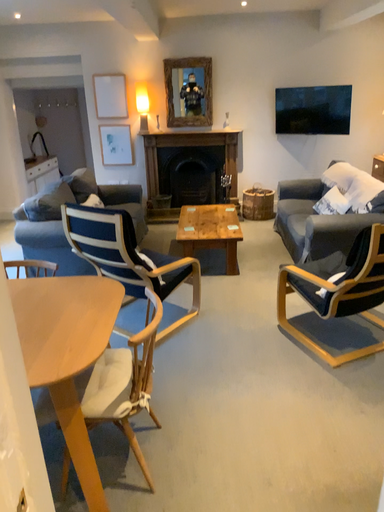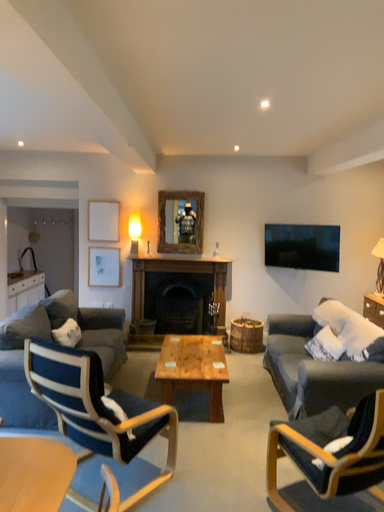
Question: Which way did the camera rotate in the video?

Choices:
 (A) rotated downward
 (B) rotated upward

Answer: (B)